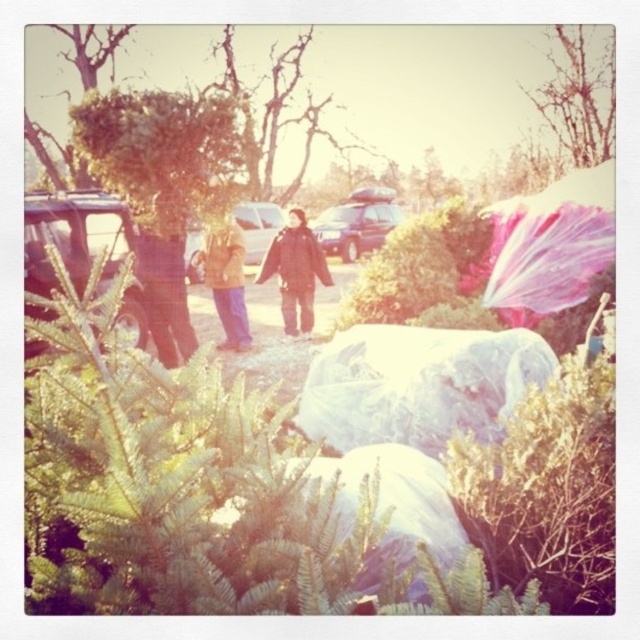
Between point (385, 198) and point (250, 216), which one is positioned in front?

Point (250, 216) is more forward.

Who is higher up, metallic silver suv at center or matte brown car at center?

Positioned higher is metallic silver suv at center.

The width and height of the screenshot is (640, 640). What do you see at coordinates (356, 221) in the screenshot?
I see `metallic silver suv at center` at bounding box center [356, 221].

I want to click on metallic silver suv at center, so click(x=356, y=221).

Between bare branches at upper right and metallic silver suv at center, which one is positioned lower?

Positioned lower is metallic silver suv at center.

Who is more distant from viewer, (612,144) or (387,218)?

The point (612,144) is more distant.

Identify the location of bare branches at upper right. This screenshot has height=640, width=640. (579, 99).

Does point (314, 232) come in front of point (237, 236)?

No, (314, 232) is further to viewer.

Can you confirm if metallic silver suv at center is thinner than light brown fabric jacket at center?

Indeed, metallic silver suv at center has a lesser width compared to light brown fabric jacket at center.

Who is more distant from viewer, (390, 227) or (243, 300)?

Positioned behind is point (390, 227).

Where is `metallic silver suv at center`? The height and width of the screenshot is (640, 640). metallic silver suv at center is located at coordinates (356, 221).